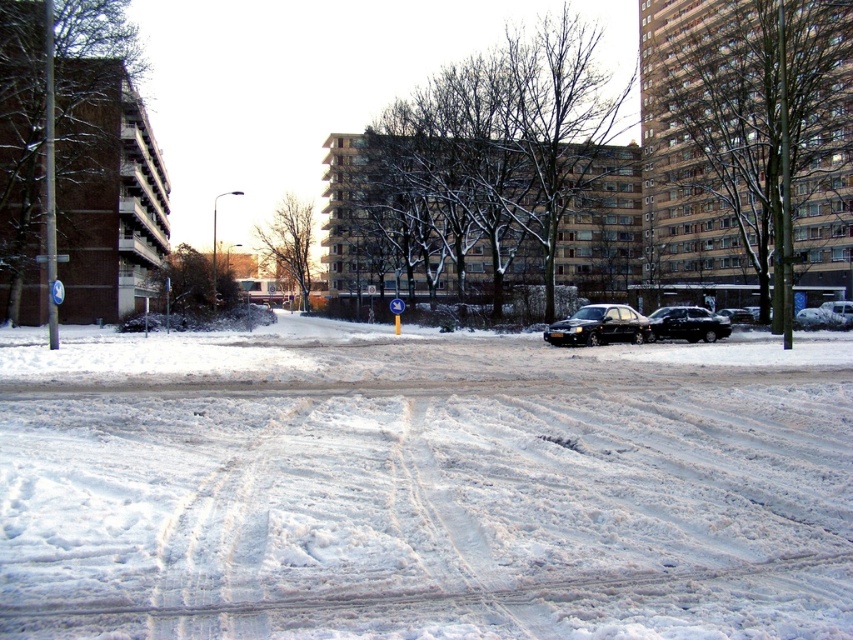
Question: Estimate the real-world distances between objects in this image. Which object is farther from the shiny black car at center?

Choices:
 (A) black glossy sedan at center
 (B) white glossy car at lower right
 (C) white powdery snow at center

Answer: (C)

Question: Estimate the real-world distances between objects in this image. Which object is farther from the black glossy sedan at center?

Choices:
 (A) shiny black car at center
 (B) white glossy car at lower right

Answer: (B)

Question: Is black glossy sedan at center smaller than white glossy car at lower right?

Choices:
 (A) no
 (B) yes

Answer: (B)

Question: Which object is the farthest from the black glossy sedan at center?

Choices:
 (A) shiny black car at center
 (B) white glossy car at lower right

Answer: (B)

Question: Can you confirm if white powdery snow at center is smaller than black glossy sedan at center?

Choices:
 (A) yes
 (B) no

Answer: (B)

Question: Is shiny black car at center behind white glossy car at lower right?

Choices:
 (A) yes
 (B) no

Answer: (B)